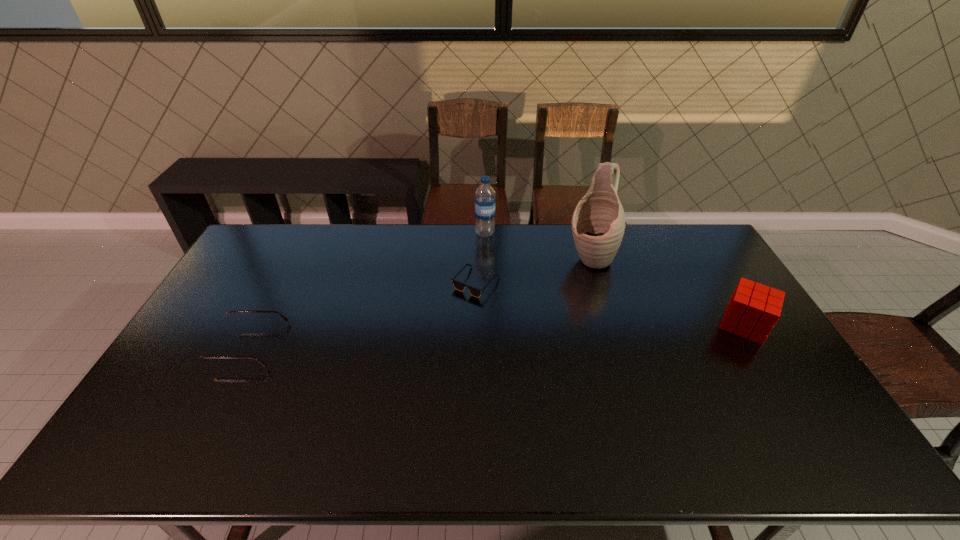
Identify the location of unoccupied position between the fourth tallest object and the farthest object. click(x=367, y=289).

Image resolution: width=960 pixels, height=540 pixels. Find the location of `empty space between the water bottle and the cube`. empty space between the water bottle and the cube is located at coordinates (614, 279).

At what (x,y) coordinates should I click in order to perform the action: click on unoccupied area between the third tallest object and the water bottle. Please return your answer as a coordinate pair (x, y). This screenshot has width=960, height=540. Looking at the image, I should click on (614, 279).

The image size is (960, 540). In order to click on free point between the fourth object from left to right and the second tallest object in this screenshot , I will do `click(538, 246)`.

The height and width of the screenshot is (540, 960). Find the location of `vacant space in between the sunglasses and the fourth tallest object`. vacant space in between the sunglasses and the fourth tallest object is located at coordinates (363, 314).

This screenshot has height=540, width=960. I want to click on vacant area between the shortest object and the rightmost object, so click(x=610, y=303).

Identify the location of vacant space in between the second object from right to left and the rightmost object. This screenshot has width=960, height=540. (667, 292).

Image resolution: width=960 pixels, height=540 pixels. Find the location of `vacant space that's between the sunglasses and the spectacles`. vacant space that's between the sunglasses and the spectacles is located at coordinates (363, 314).

The width and height of the screenshot is (960, 540). Identify the location of vacant area that lies between the shortest object and the water bottle. (480, 258).

In order to click on the third closest object to the farthest object in this screenshot , I will do `click(209, 350)`.